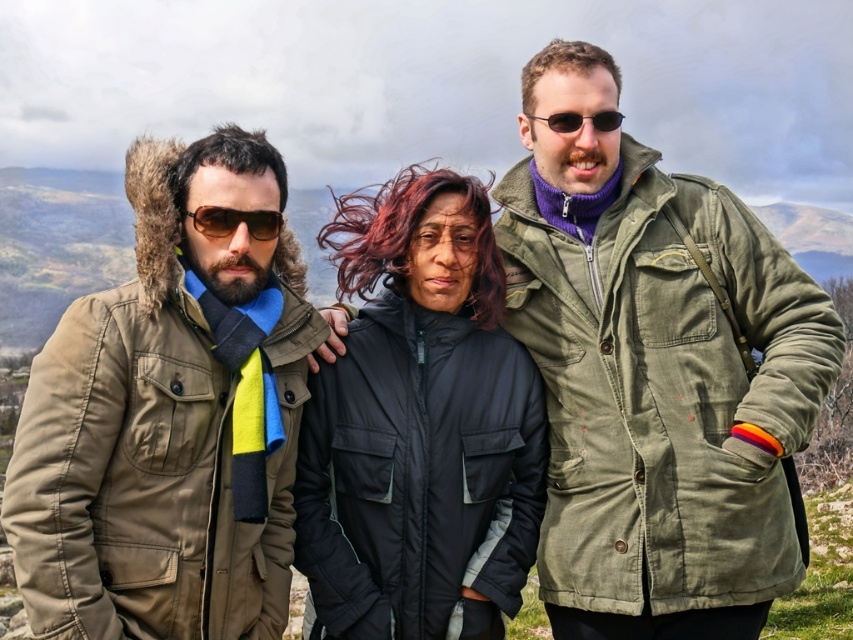
Question: Which object is closer to the camera taking this photo?

Choices:
 (A) sunglasses at center
 (B) black puffy jacket at center

Answer: (A)

Question: Which of these objects is positioned farthest from the black puffy jacket at center?

Choices:
 (A) sunglasses at center
 (B) matte brown sunglasses at center
 (C) khaki fabric jacket at left

Answer: (A)

Question: Is khaki fabric jacket at left to the left of matte brown sunglasses at center from the viewer's perspective?

Choices:
 (A) yes
 (B) no

Answer: (A)

Question: Does khaki fabric jacket at left have a larger size compared to sunglasses at center?

Choices:
 (A) yes
 (B) no

Answer: (A)

Question: Among these points, which one is farthest from the camera?

Choices:
 (A) (408, 394)
 (B) (561, 113)

Answer: (A)

Question: Is olive-green canvas jacket at center-right closer to the viewer compared to black puffy jacket at center?

Choices:
 (A) yes
 (B) no

Answer: (A)